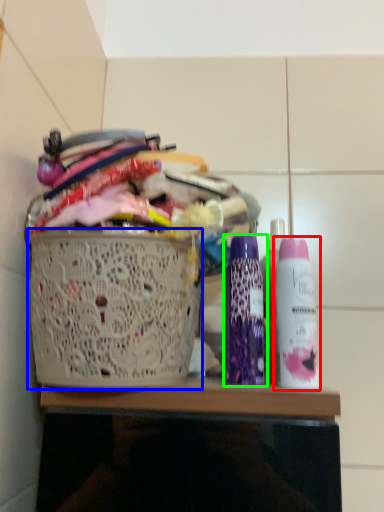
Question: Based on their relative distances, which object is nearer to bottle (highlighted by a red box)? Choose from basket (highlighted by a blue box) and bottle (highlighted by a green box).

Choices:
 (A) basket
 (B) bottle

Answer: (B)